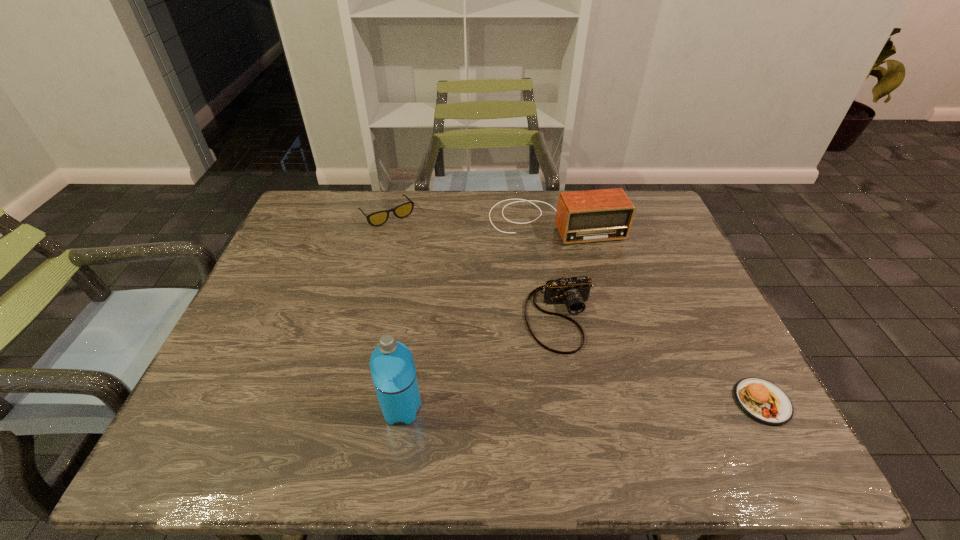
Locate an element on the screen. This screenshot has height=540, width=960. the fourth object from right to left is located at coordinates (393, 372).

You are a GUI agent. You are given a task and a screenshot of the screen. Output one action in this format:
    pyautogui.click(x=<x>, y=<y>)
    Task: Click on the thermos bottle
    This screenshot has width=960, height=540.
    Given the screenshot: What is the action you would take?
    [x=393, y=372]

Where is `patty`? This screenshot has height=540, width=960. patty is located at coordinates (763, 401).

Find the location of `the third farthest object`. the third farthest object is located at coordinates (574, 291).

Where is `camera`? camera is located at coordinates (574, 291).

This screenshot has height=540, width=960. I want to click on sunglasses, so click(x=375, y=219).

Find the location of a particular element. Image resolution: width=960 pixels, height=540 pixels. radio receiver is located at coordinates (595, 215).

Identify the location of free space located 0.330m on the right of the thermos bottle. (582, 409).

Locate an element on the screen. The width and height of the screenshot is (960, 540). vacant space located on the left of the rightmost object is located at coordinates tap(663, 402).

The height and width of the screenshot is (540, 960). Find the location of `vacant space located 0.070m on the front-facing side of the camera`. vacant space located 0.070m on the front-facing side of the camera is located at coordinates (580, 380).